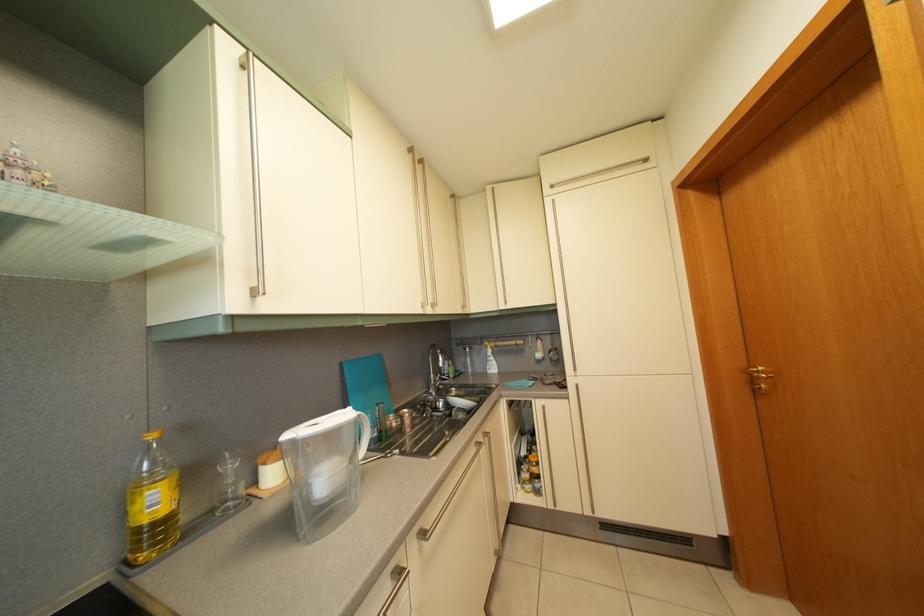
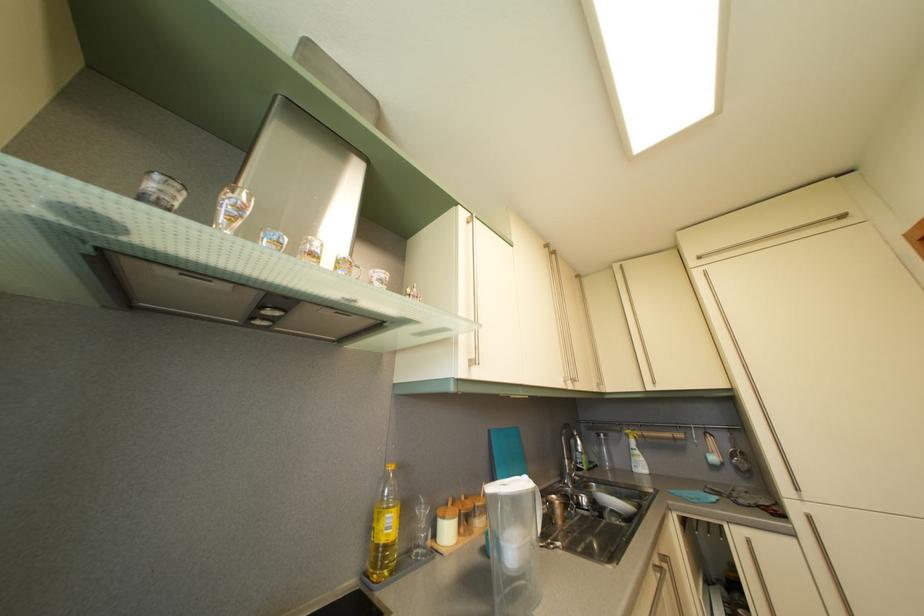
Where in the second image is the point corresponding to pixel 496 197 from the first image?

(624, 274)